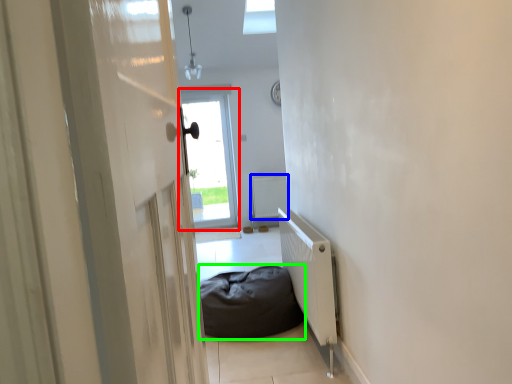
Question: Based on their relative distances, which object is farther from window (highlighted by a red box)? Choose from radiator (highlighted by a blue box) and furniture (highlighted by a green box).

Choices:
 (A) radiator
 (B) furniture

Answer: (B)